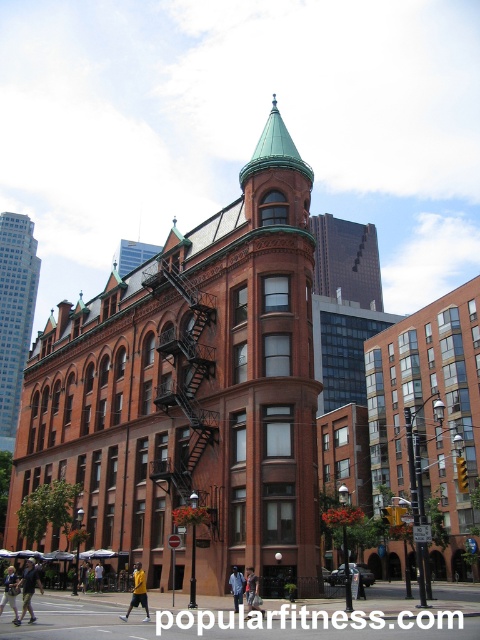
You are a delivery person carrying a large package that is 1.2 meters wide. You need to navigate through the area between the black metal fire escape at center and the light blue jeans at center. Can you pass through this space with your package?

The black metal fire escape at center might be wider than light blue jeans at center, so there is a possibility that the space between them is at least 1.2 meters wide. However, since the exact width isn not specified, it is uncertain whether the package will fit. You should measure the space or look for an alternative route to ensure safety.

You are standing on the sidewalk in front of the historic red brick building. You see the black metal fire escape at center and the light blue jeans at center. How far apart are these two objects from each other?

The black metal fire escape at center is 16.81 meters away from the light blue jeans at center.